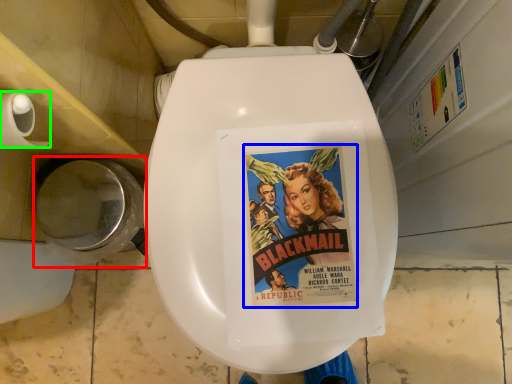
Question: Which object is the farthest from toilet bowl (highlighted by a red box)? Choose among these: movie poster (highlighted by a blue box) or toilet paper (highlighted by a green box).

Choices:
 (A) movie poster
 (B) toilet paper

Answer: (A)